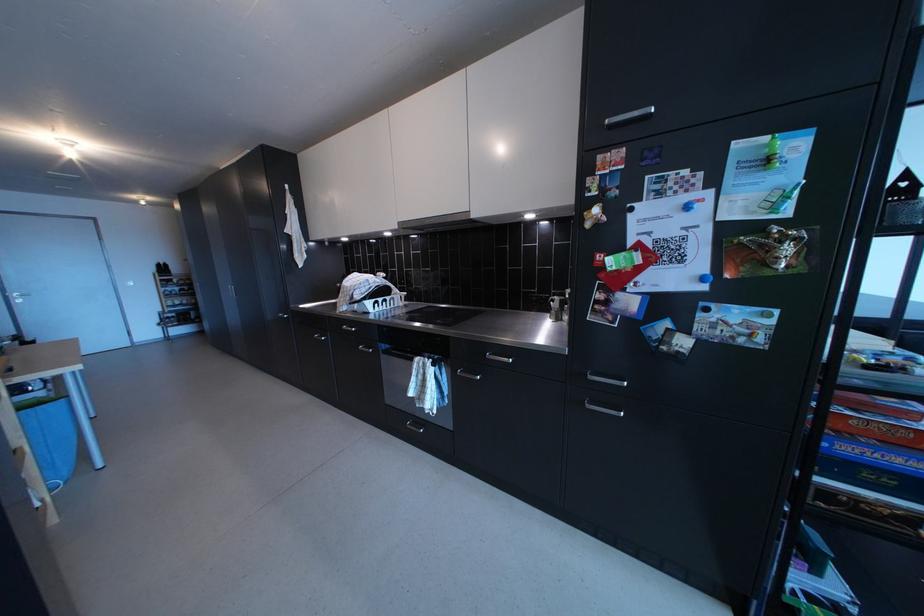
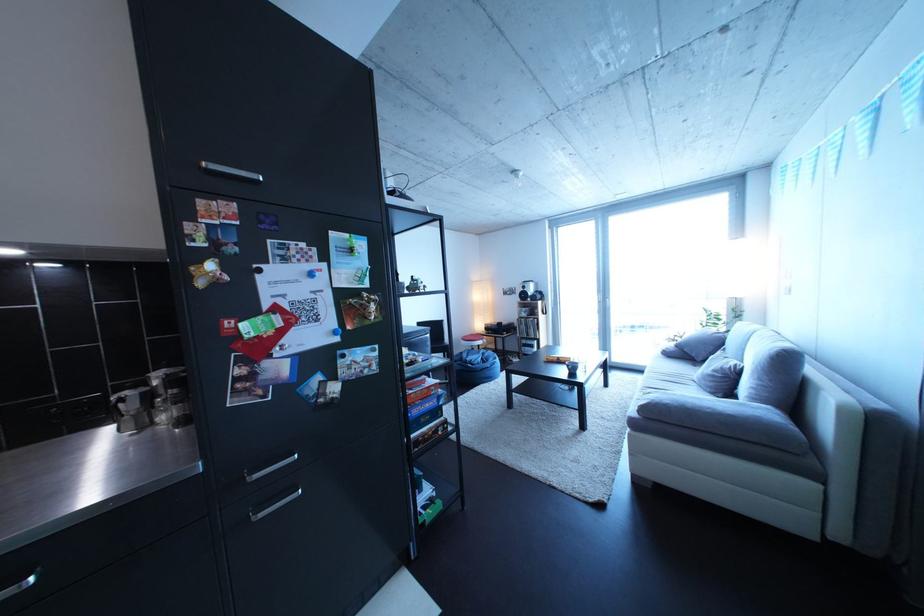
Where in the second image is the point corresponding to (869,416) from the first image?

(424, 395)